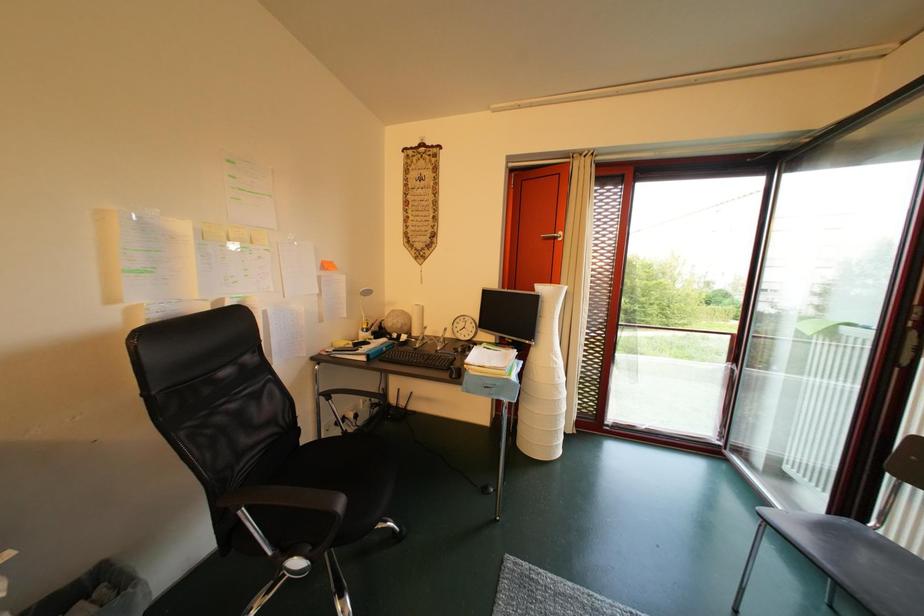
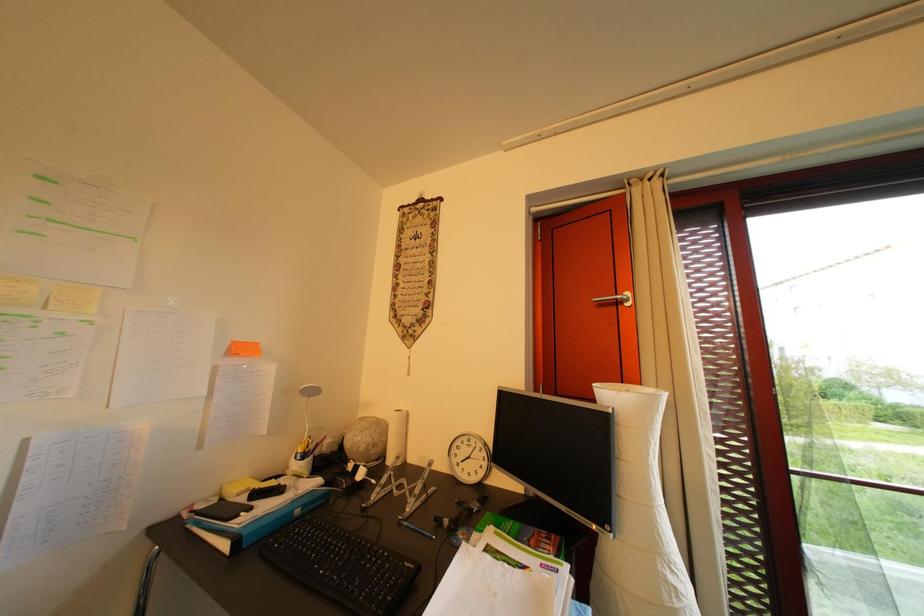
Question: The images are taken continuously from a first-person perspective. In which direction are you moving?

Choices:
 (A) Left
 (B) Right
 (C) Forward
 (D) Backward

Answer: (C)